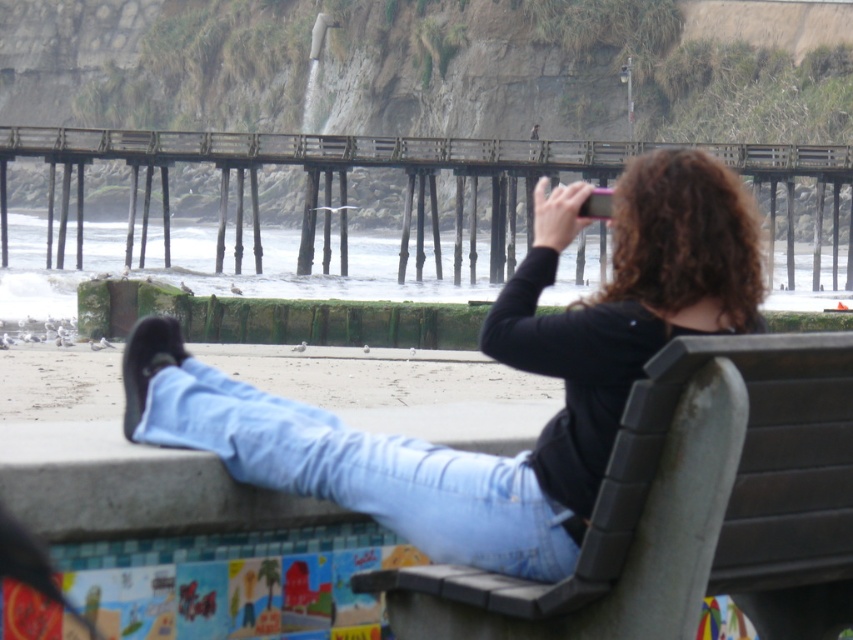
Question: Is gray plastic bench at lower right to the right of wooden pier at center from the viewer's perspective?

Choices:
 (A) yes
 (B) no

Answer: (A)

Question: Which is farther from the gray plastic bench at lower right?

Choices:
 (A) light blue denim jeans at lower center
 (B) black matte shirt at upper center
 (C) wooden pier at center

Answer: (C)

Question: Which point is closer to the camera taking this photo?

Choices:
 (A) (252, 216)
 (B) (759, 602)

Answer: (B)

Question: Can you confirm if gray plastic bench at lower right is smaller than wooden pier at center?

Choices:
 (A) no
 (B) yes

Answer: (B)

Question: Which object appears farthest from the camera in this image?

Choices:
 (A) gray plastic bench at lower right
 (B) black matte shirt at upper center
 (C) wooden pier at center
 (D) light blue denim jeans at lower center

Answer: (C)

Question: Where is black matte shirt at upper center located in relation to light blue denim jeans at lower center in the image?

Choices:
 (A) right
 (B) left

Answer: (B)